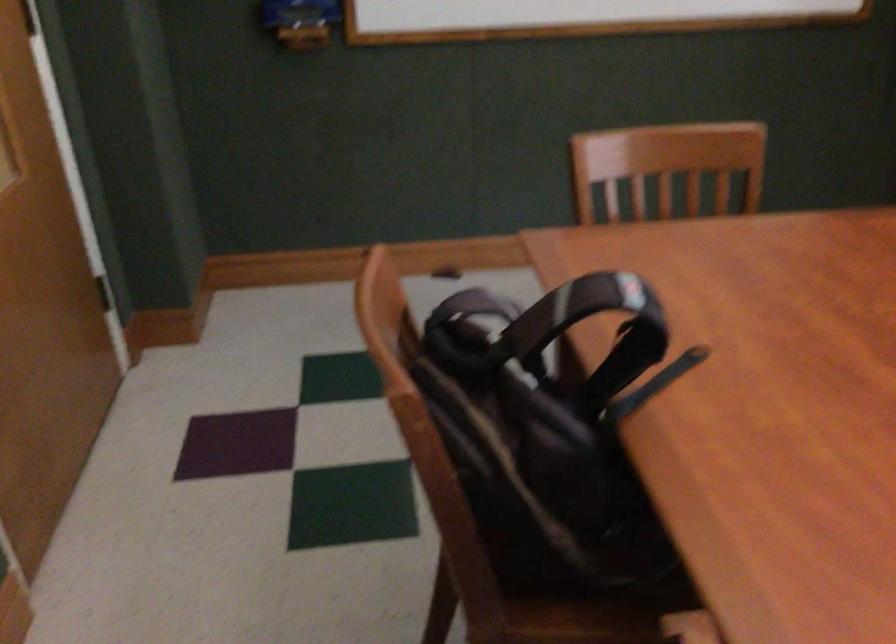
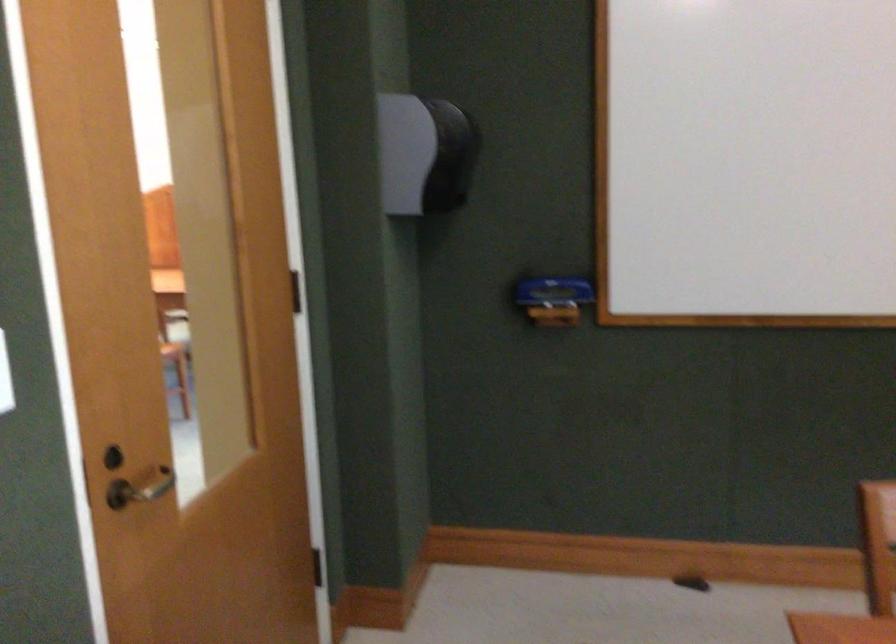
Question: Which direction would the cameraman need to move to produce the second image? Reply with the corresponding letter.

Choices:
 (A) Left
 (B) Right
 (C) Forward
 (D) Backward

Answer: (C)